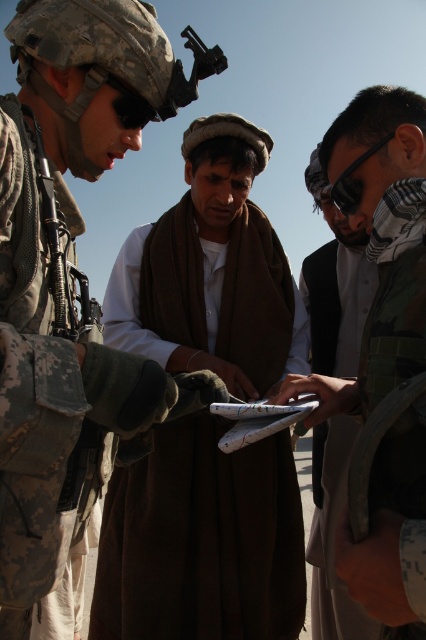
You are a photographer trying to capture a group photo of the white cotton shirt at center and the brown woolen shawl at center. To ensure both are in the frame, should you position the camera to the left or right side of the two individuals?

The white cotton shirt at center is to the left of the brown woolen shawl at center, so positioning the camera to the right side would ensure both are in the frame.

You are a photographer trying to capture a group photo of the three individuals. You want to ensure the brown woolen shawl at center and the white fabric shirt at center are both visible in the frame. Based on their positions, which one should you focus on first to ensure both are in the shot?

The brown woolen shawl at center is positioned on the left side of white fabric shirt at center, so focusing on the white fabric shirt at center first would ensure both are included in the frame since the shawl is to the left of it.

You are a photographer trying to capture a detailed shot of the brown woolen shawl at center and the white fabric shirt at center. Which item should you zoom in on to ensure both are clearly visible without moving the camera?

The brown woolen shawl at center is smaller in size compared to the white fabric shirt at center, so you should zoom in on the brown woolen shawl at center to ensure both items are clearly visible without moving the camera.